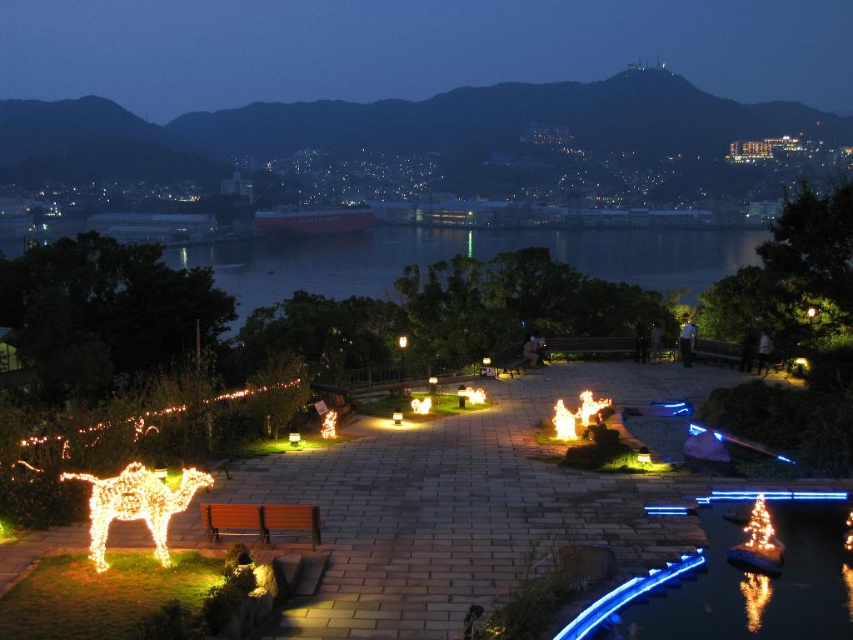
Question: Considering the real-world distances, which object is farthest from the illuminated wireframe camel at lower left?

Choices:
 (A) blue illuminated water at lower right
 (B) brown wooden bench at lower left

Answer: (A)

Question: Which object appears closest to the camera in this image?

Choices:
 (A) brown wooden bench at lower left
 (B) illuminated wireframe camel at lower left
 (C) blue illuminated water at lower right

Answer: (B)

Question: Is blue illuminated water at lower right further to the viewer compared to brown wooden bench at lower left?

Choices:
 (A) no
 (B) yes

Answer: (A)

Question: Which object is farther from the camera taking this photo?

Choices:
 (A) brown wooden bench at lower left
 (B) illuminated wireframe camel at lower left

Answer: (A)

Question: Is blue illuminated water at lower right below illuminated wireframe camel at lower left?

Choices:
 (A) no
 (B) yes

Answer: (B)

Question: Does blue illuminated water at lower right come in front of brown wooden bench at lower left?

Choices:
 (A) no
 (B) yes

Answer: (B)